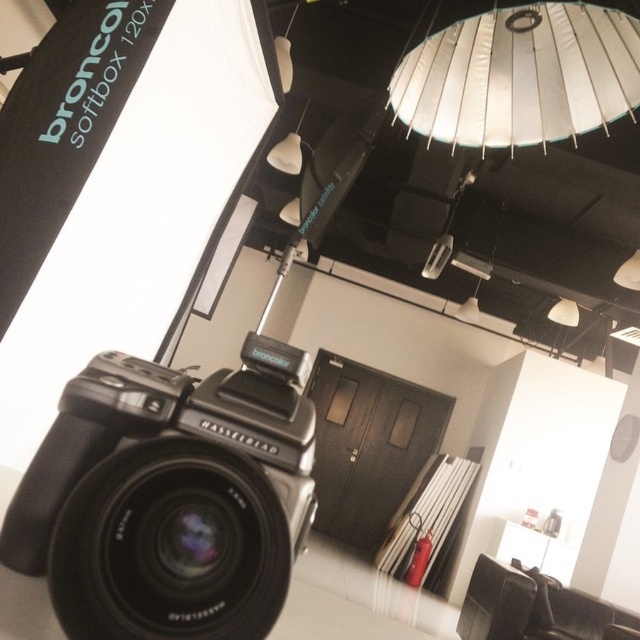
Is black matte hasselblad camera at center positioned before white fabric lampshade at upper center?

That is True.

Who is shorter, black matte hasselblad camera at center or white fabric lampshade at upper center?

black matte hasselblad camera at center is shorter.

Is point (189, 454) positioned before point (440, 104)?

Yes, point (189, 454) is in front of point (440, 104).

Where is `black matte hasselblad camera at center`? This screenshot has width=640, height=640. black matte hasselblad camera at center is located at coordinates (170, 497).

Is point (605, 24) positioned behind point (572, 324)?

That is False.

Who is more forward, (592, 44) or (547, 316)?

Point (592, 44)

At what (x,y) coordinates should I click in order to perform the action: click on white fabric lampshade at upper center. Please return your answer as a coordinate pair (x, y). Looking at the image, I should click on (518, 76).

Who is positioned more to the right, black matte hasselblad camera at center or white matte lampshade at upper center?

white matte lampshade at upper center is more to the right.

Who is taller, black matte hasselblad camera at center or white matte lampshade at upper center?

white matte lampshade at upper center

Identify the location of black matte hasselblad camera at center. (170, 497).